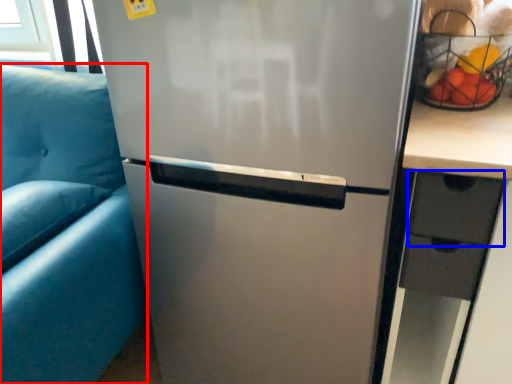
Question: Which object appears closest to the camera in this image, armchair (highlighted by a red box) or drawer (highlighted by a blue box)?

Choices:
 (A) armchair
 (B) drawer

Answer: (A)